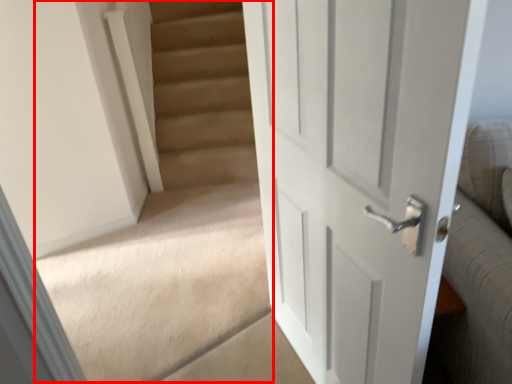
Question: In this image, where is stairwell (annotated by the red box) located relative to door?

Choices:
 (A) right
 (B) left

Answer: (B)